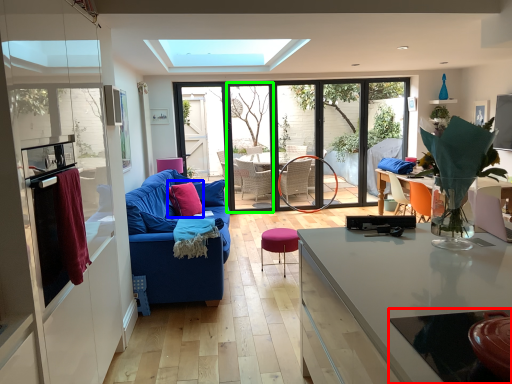
Question: Which is nearer to the glass table (highlighted by a red box)? throw pillow (highlighted by a blue box) or glass door (highlighted by a green box).

Choices:
 (A) throw pillow
 (B) glass door

Answer: (A)